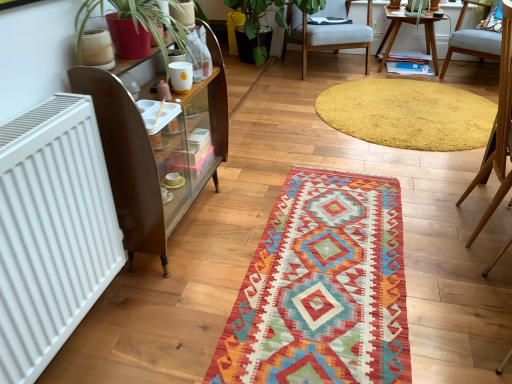
I want to click on free area behind light blue fabric chair at right, which is the 1th chair from front to back, so click(x=442, y=179).